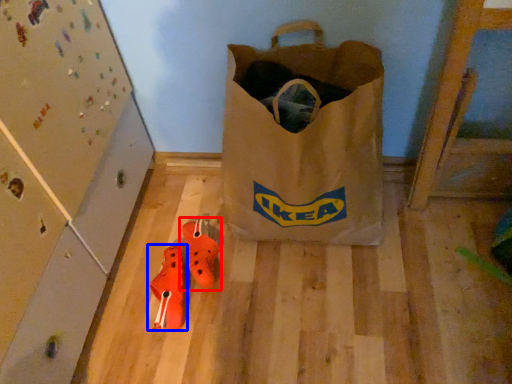
Question: Which object is further to the camera taking this photo, footwear (highlighted by a red box) or footwear (highlighted by a blue box)?

Choices:
 (A) footwear
 (B) footwear

Answer: (A)